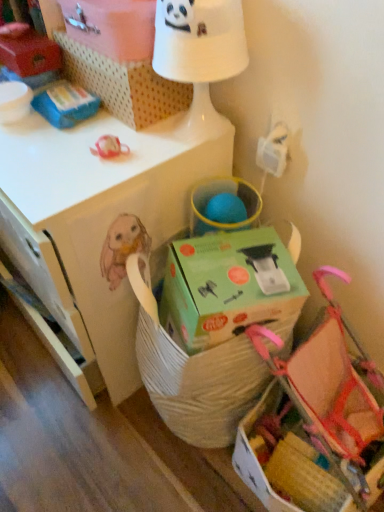
Image resolution: width=384 pixels, height=512 pixels. Identify the location of free spot below white glossy table lamp at upper center (from a real-world perspective). (196, 130).